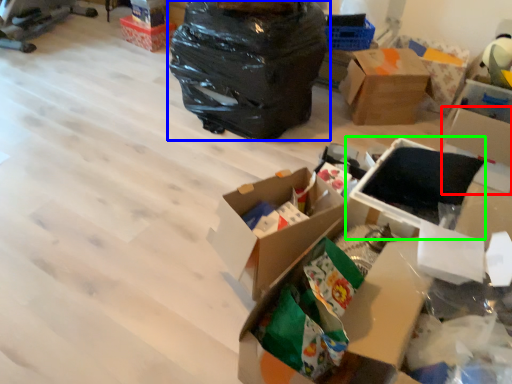
Question: Which object is the closest to the storage box (highlighted by a red box)? Choose among these: plastic bag (highlighted by a blue box) or storage box (highlighted by a green box).

Choices:
 (A) plastic bag
 (B) storage box

Answer: (B)